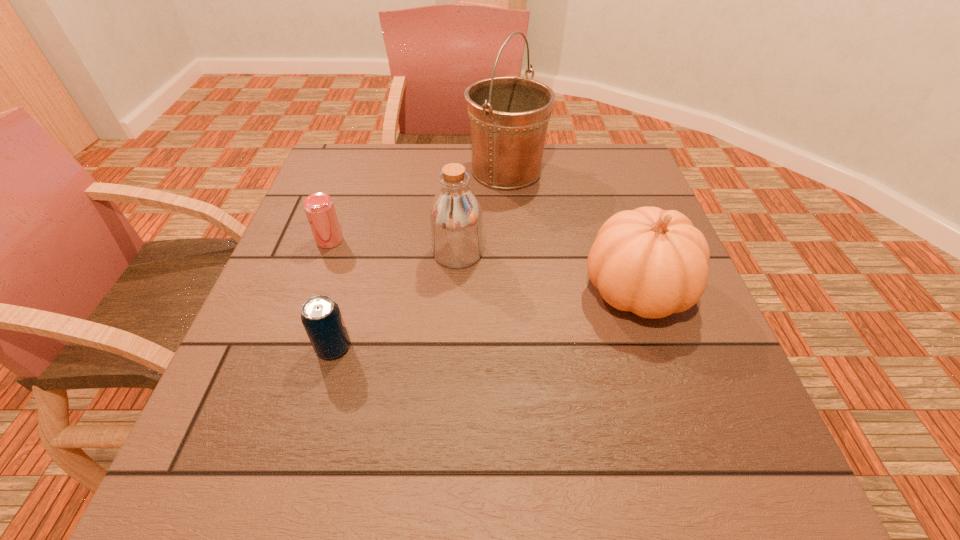
Image resolution: width=960 pixels, height=540 pixels. I want to click on free space between the leftmost object and the tallest object, so click(418, 205).

Locate an element on the screen. The width and height of the screenshot is (960, 540). free space that is in between the leftmost object and the farthest object is located at coordinates (418, 205).

The height and width of the screenshot is (540, 960). I want to click on free point between the pumpkin and the bottle, so click(546, 272).

You are a GUI agent. You are given a task and a screenshot of the screen. Output one action in this format:
    pyautogui.click(x=<x>, y=<y>)
    Task: Click on the vacant point located between the second object from left to right and the farthest object
    This screenshot has height=540, width=960.
    Given the screenshot: What is the action you would take?
    pyautogui.click(x=420, y=259)

Identify the location of free spot between the second object from left to right and the bottle. Image resolution: width=960 pixels, height=540 pixels. (396, 300).

At what (x,y) coordinates should I click in order to perform the action: click on empty location between the tallest object and the pumpkin. Please return your answer as a coordinate pair (x, y). This screenshot has height=540, width=960. Looking at the image, I should click on (571, 231).

This screenshot has width=960, height=540. I want to click on free spot between the leftmost object and the second object from left to right, so click(331, 294).

Locate an element on the screen. empty space that is in between the soda can and the bucket is located at coordinates (420, 259).

Image resolution: width=960 pixels, height=540 pixels. I want to click on unoccupied area between the second object from left to right and the bottle, so click(396, 300).

Find the location of a particular element. free space between the farthest object and the beer can is located at coordinates (418, 205).